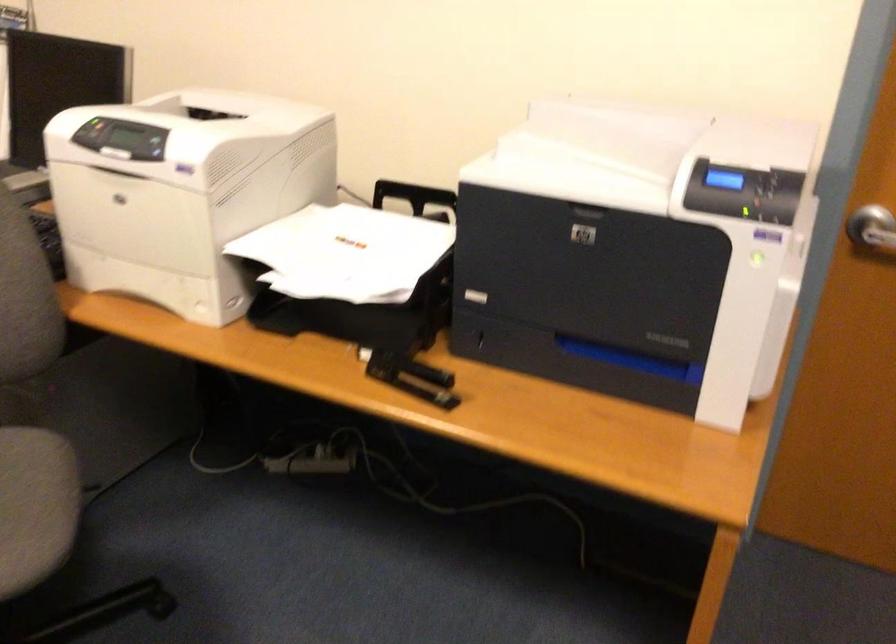
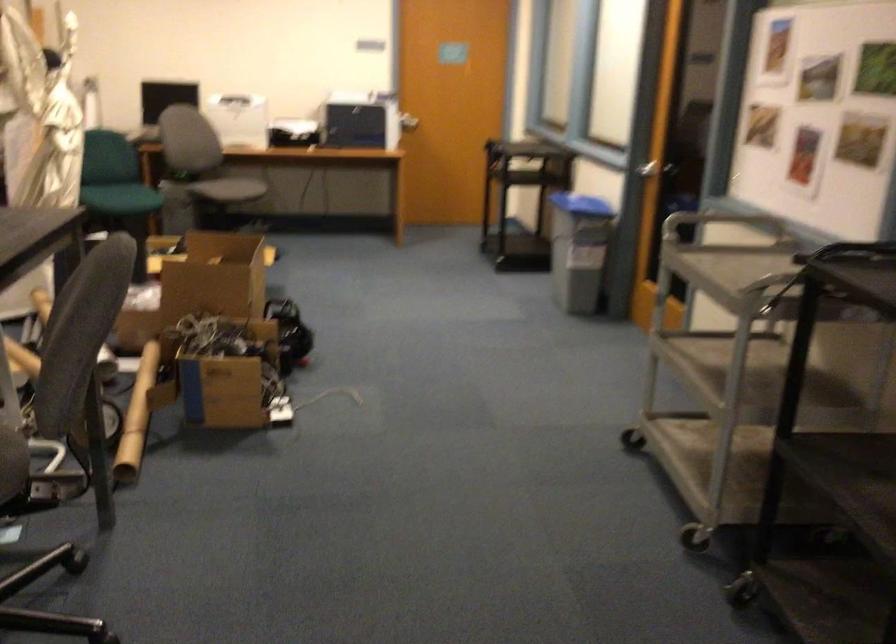
Question: I am providing you with two images of the same scene from different viewpoints. Which of the following objects are not visible in image2?

Choices:
 (A) orange toy box
 (B) printer control buttons
 (C) grey chair sitting surface
 (D) silver cart handle

Answer: (B)